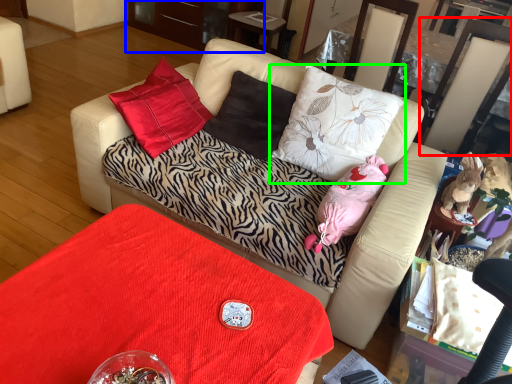
Question: Estimate the real-world distances between objects in this image. Which object is closer to swivel chair (highlighted by a red box), dresser (highlighted by a blue box) or pillow (highlighted by a green box)?

Choices:
 (A) dresser
 (B) pillow

Answer: (B)